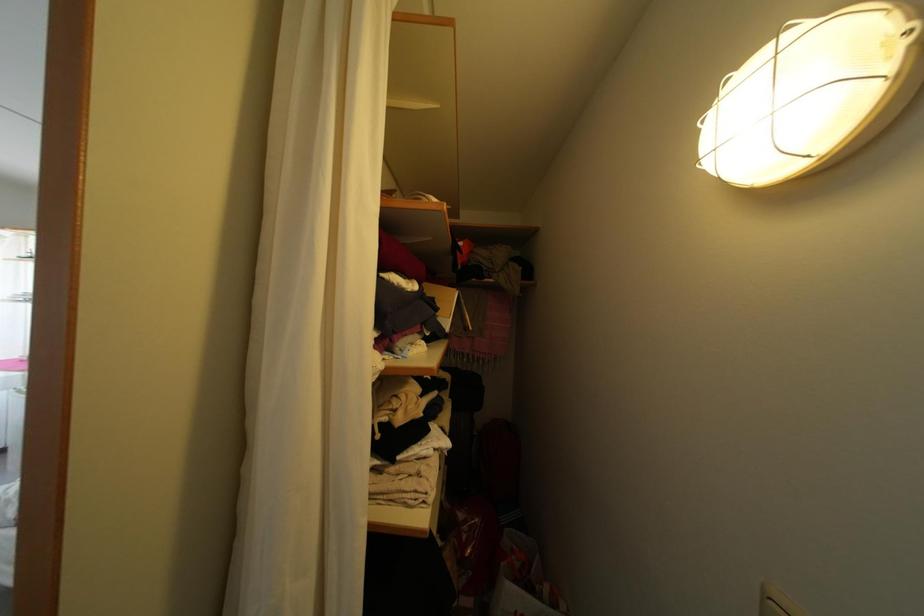
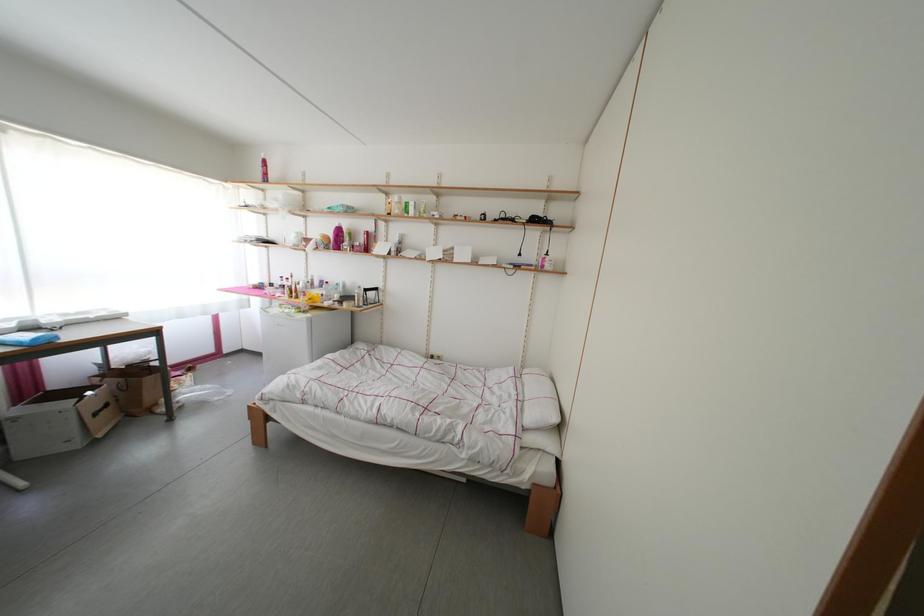
Question: The images are taken continuously from a first-person perspective. In which direction are you moving?

Choices:
 (A) Left
 (B) Right
 (C) Forward
 (D) Backward

Answer: (A)